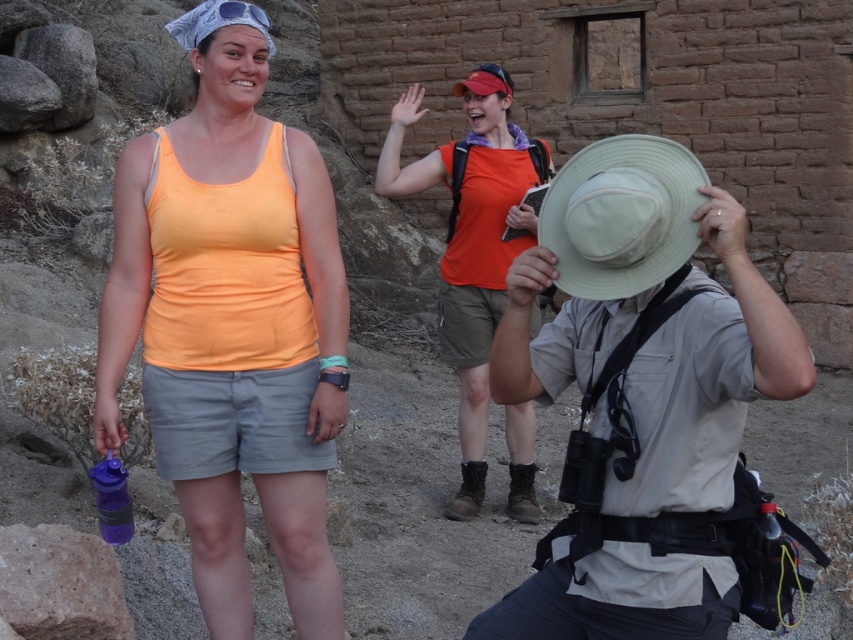
Which is below, khaki fabric hat at center or orange fabric shirt at center?

khaki fabric hat at center

The image size is (853, 640). Identify the location of khaki fabric hat at center. (640, 394).

Is orange matte tank top at center to the left of purple translucent water bottle at lower left from the viewer's perspective?

A: No, orange matte tank top at center is not to the left of purple translucent water bottle at lower left.

Does point (222, 163) come farther from viewer compared to point (117, 461)?

No, it is in front of (117, 461).

Does point (309, 140) come behind point (103, 504)?

Yes, it is behind point (103, 504).

The height and width of the screenshot is (640, 853). In order to click on orange matte tank top at center in this screenshot , I will do `click(231, 323)`.

This screenshot has height=640, width=853. What do you see at coordinates (471, 240) in the screenshot?
I see `orange fabric shirt at center` at bounding box center [471, 240].

Consider the image. Does orange fabric shirt at center appear on the right side of purple translucent water bottle at lower left?

Indeed, orange fabric shirt at center is positioned on the right side of purple translucent water bottle at lower left.

Is point (485, 147) farther from viewer compared to point (119, 525)?

Yes.

Where is `orange fabric shirt at center`? orange fabric shirt at center is located at coordinates (471, 240).